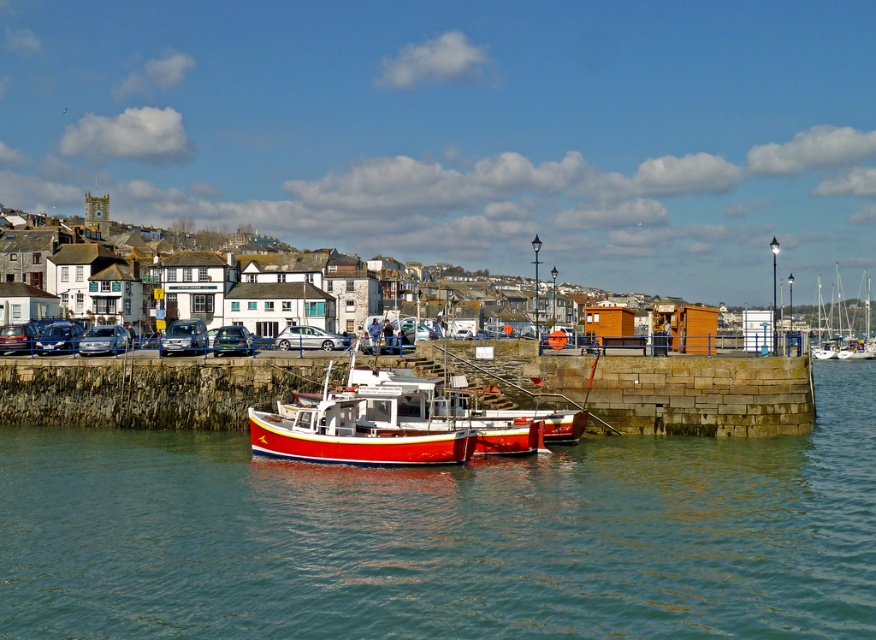
Question: Which of these objects is positioned farthest from the white wooden sailboat at right?

Choices:
 (A) red matte boat at center
 (B) matte black car at left
 (C) metallic blue car at left
 (D) transparent water at center

Answer: (B)

Question: Can you confirm if satin silver car at center is bigger than matte silver sedan at left?

Choices:
 (A) yes
 (B) no

Answer: (B)

Question: Which of the following is the closest to the observer?

Choices:
 (A) metallic blue car at left
 (B) red matte boat at center

Answer: (B)

Question: Does matte black car at left appear on the right side of metallic blue car at center?

Choices:
 (A) no
 (B) yes

Answer: (A)

Question: Can you confirm if metallic silver van at center is wider than metallic blue car at center?

Choices:
 (A) no
 (B) yes

Answer: (B)

Question: Which of the following is the closest to the observer?

Choices:
 (A) (32, 330)
 (B) (295, 419)
 (C) (225, 340)
 (D) (288, 333)

Answer: (B)